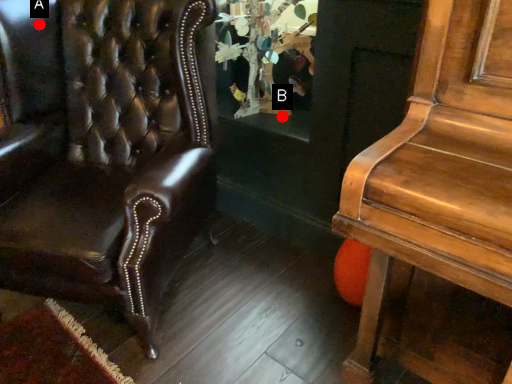
Question: Two points are circled on the image, labeled by A and B beside each circle. Which point is farther to the camera?

Choices:
 (A) A is further
 (B) B is further

Answer: (B)